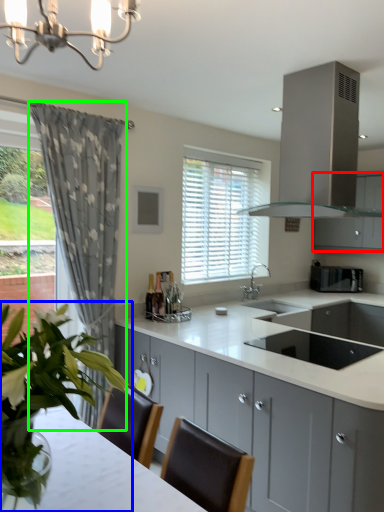
Question: Which is nearer to the cabinetry (highlighted by a red box)? houseplant (highlighted by a blue box) or curtain (highlighted by a green box).

Choices:
 (A) houseplant
 (B) curtain

Answer: (B)